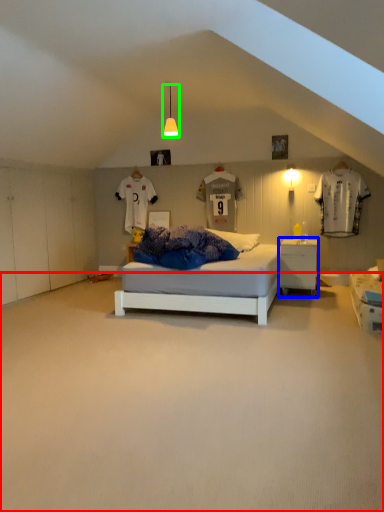
Question: Which object is positioned closest to plain (highlighted by a red box)? Select from nightstand (highlighted by a blue box) and light fixture (highlighted by a green box).

Choices:
 (A) nightstand
 (B) light fixture

Answer: (A)